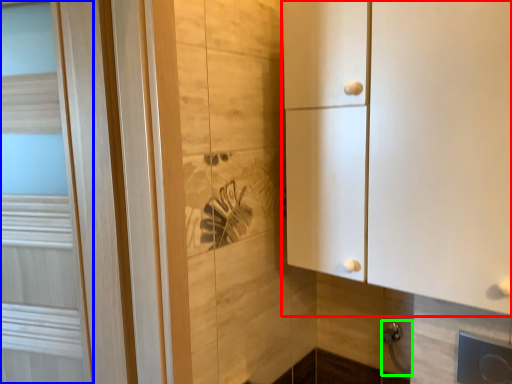
Question: Considering the real-world distances, which object is closest to cupboard (highlighted by a red box)? door (highlighted by a blue box) or door handle (highlighted by a green box).

Choices:
 (A) door
 (B) door handle

Answer: (B)